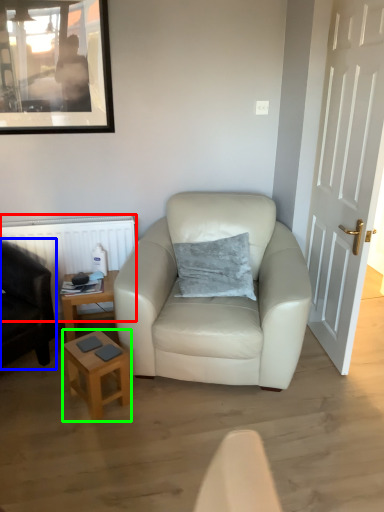
Question: Which is farther away from radiator (highlighted by a red box)? chair (highlighted by a blue box) or stool (highlighted by a green box)?

Choices:
 (A) chair
 (B) stool

Answer: (B)